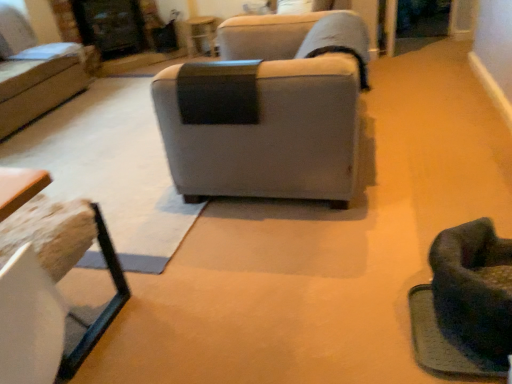
Question: Can you confirm if wooden textured table at lower left, marked as the first table in a bottom-to-top arrangement, is shorter than soft green fabric swivel chair at lower right?

Choices:
 (A) no
 (B) yes

Answer: (A)

Question: Is wooden textured table at lower left, marked as the first table in a bottom-to-top arrangement, looking in the opposite direction of soft green fabric swivel chair at lower right?

Choices:
 (A) no
 (B) yes

Answer: (A)

Question: From a real-world perspective, is wooden textured table at lower left, which ranks as the 2th table in back-to-front order, physically below soft green fabric swivel chair at lower right?

Choices:
 (A) no
 (B) yes

Answer: (A)

Question: Considering the relative positions of wooden textured table at lower left, which ranks as the 2th table in back-to-front order, and soft green fabric swivel chair at lower right in the image provided, is wooden textured table at lower left, which ranks as the 2th table in back-to-front order, to the right of soft green fabric swivel chair at lower right from the viewer's perspective?

Choices:
 (A) yes
 (B) no

Answer: (B)

Question: Can you confirm if wooden textured table at lower left, which ranks as the 2th table in back-to-front order, is wider than soft green fabric swivel chair at lower right?

Choices:
 (A) no
 (B) yes

Answer: (B)

Question: From the image's perspective, is matte black table at upper center, which appears as the first table when viewed from the back, above or below matte gray couch at upper left, which appears as the first studio couch when viewed from the back?

Choices:
 (A) above
 (B) below

Answer: (A)

Question: From a real-world perspective, is matte black table at upper center, the second table from the bottom, above or below matte gray couch at upper left, arranged as the 2th studio couch when ordered from the bottom?

Choices:
 (A) above
 (B) below

Answer: (B)

Question: Does point (205, 36) appear closer or farther from the camera than point (83, 61)?

Choices:
 (A) farther
 (B) closer

Answer: (A)

Question: Considering the positions of matte black table at upper center, the first table in the top-to-bottom sequence, and matte gray couch at upper left, arranged as the 2th studio couch when ordered from the bottom, in the image, is matte black table at upper center, the first table in the top-to-bottom sequence, wider or thinner than matte gray couch at upper left, arranged as the 2th studio couch when ordered from the bottom,?

Choices:
 (A) thin
 (B) wide

Answer: (A)

Question: Relative to wooden textured table at lower left, which ranks as the 2th table in back-to-front order, is gray fabric couch at center, which is the first studio couch from right to left, in front or behind?

Choices:
 (A) front
 (B) behind

Answer: (B)

Question: From a real-world perspective, is gray fabric couch at center, acting as the second studio couch starting from the left, positioned above or below wooden textured table at lower left, which ranks as the 2th table in back-to-front order?

Choices:
 (A) above
 (B) below

Answer: (A)

Question: Looking at their shapes, would you say gray fabric couch at center, the second studio couch in the top-to-bottom sequence, is wider or thinner than wooden textured table at lower left, which ranks as the first table in front-to-back order?

Choices:
 (A) wide
 (B) thin

Answer: (A)

Question: From the image's perspective, is gray fabric couch at center, acting as the second studio couch starting from the left, located above or below wooden textured table at lower left, which ranks as the 2th table in back-to-front order?

Choices:
 (A) below
 (B) above

Answer: (B)

Question: In the image, is wooden textured table at lower left, which ranks as the 2th table in back-to-front order, positioned in front of or behind gray fabric couch at center, the second studio couch in the top-to-bottom sequence?

Choices:
 (A) front
 (B) behind

Answer: (A)

Question: Does point (13, 375) appear closer or farther from the camera than point (309, 180)?

Choices:
 (A) closer
 (B) farther

Answer: (A)